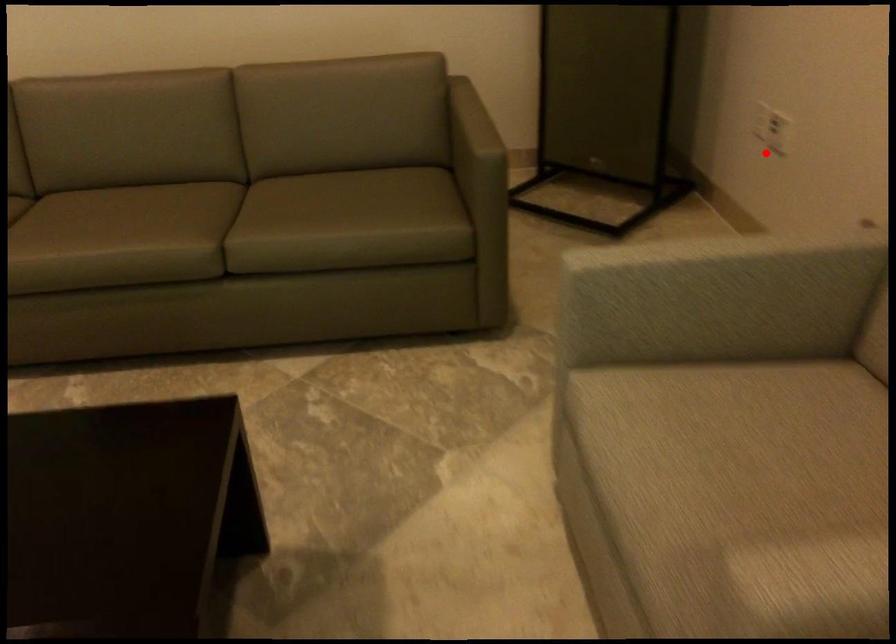
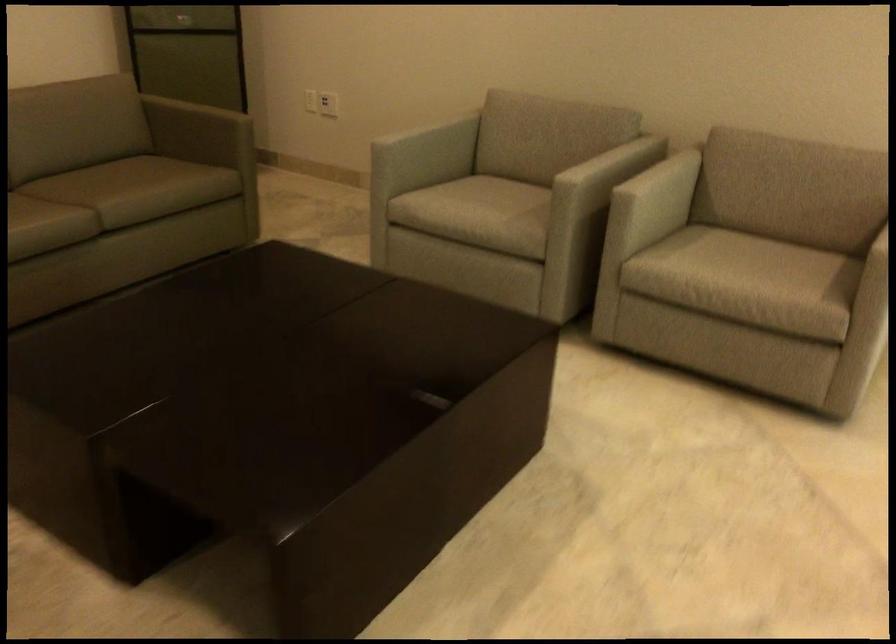
In the second image, find the point that corresponds to the highlighted location in the first image.

(328, 104)